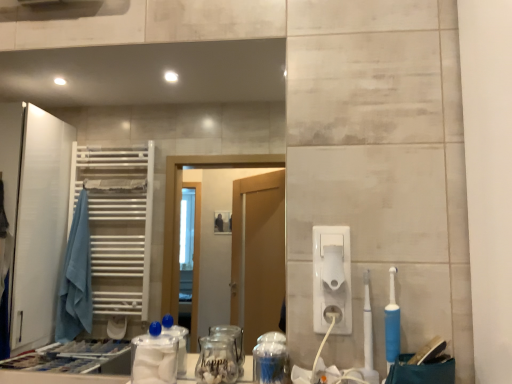
What is the approximate width of white plastic toothbrush at right, placed as the 2th toothbrush when sorted from right to left?

It is 2.90 centimeters.

Measure the distance between point (368, 293) and camera.

A distance of 35.08 inches exists between point (368, 293) and camera.

This screenshot has width=512, height=384. What do you see at coordinates (154, 357) in the screenshot?
I see `transparent plastic container at center` at bounding box center [154, 357].

The height and width of the screenshot is (384, 512). I want to click on transparent glass jar at center, the 2th glass jar when ordered from right to left, so click(x=216, y=360).

Where is `matte white mirror at upper center`? matte white mirror at upper center is located at coordinates (159, 69).

This screenshot has width=512, height=384. I want to click on transparent glass jar at center, which is the 2th glass jar in left-to-right order, so click(270, 359).

From a real-world perspective, which object stands above the other?

In real-world perspective, white plastic toothbrush at right, the first toothbrush from the left, is above.

Between white plastic toothbrush at right, placed as the 2th toothbrush when sorted from right to left, and transparent glass jar at center, the 1th glass jar viewed from the left, which one has smaller size?

With smaller size is white plastic toothbrush at right, placed as the 2th toothbrush when sorted from right to left.

Considering the sizes of objects white plastic toothbrush at right, placed as the 2th toothbrush when sorted from right to left, and transparent glass jar at center, the 2th glass jar when ordered from right to left, in the image provided, who is taller, white plastic toothbrush at right, placed as the 2th toothbrush when sorted from right to left, or transparent glass jar at center, the 2th glass jar when ordered from right to left,?

Standing taller between the two is white plastic toothbrush at right, placed as the 2th toothbrush when sorted from right to left.

What's the angular difference between white plastic toothbrush at right, placed as the 2th toothbrush when sorted from right to left, and transparent glass jar at center, the 1th glass jar viewed from the left,'s facing directions?

white plastic toothbrush at right, placed as the 2th toothbrush when sorted from right to left, and transparent glass jar at center, the 1th glass jar viewed from the left, are facing 6.18 degrees away from each other.

Is matte white mirror at upper center at the left side of white plastic toothbrush at right, placed as the 2th toothbrush when sorted from right to left?

Indeed, matte white mirror at upper center is positioned on the left side of white plastic toothbrush at right, placed as the 2th toothbrush when sorted from right to left.

Does point (62, 61) come farther from viewer compared to point (367, 307)?

Yes, point (62, 61) is farther from viewer.

Is white plastic toothbrush at right, the first toothbrush from the left, completely or partially inside matte white mirror at upper center?

No, white plastic toothbrush at right, the first toothbrush from the left, is not a part of matte white mirror at upper center.

Does matte white mirror at upper center lie behind white plastic toothbrush at right, placed as the 2th toothbrush when sorted from right to left?

Yes, matte white mirror at upper center is further from the camera.

At what (x,y) coordinates should I click in order to perform the action: click on hand dryer behind the white plastic toilet paper at center-right. Please return your answer as a coordinate pair (x, y). The width and height of the screenshot is (512, 384). Looking at the image, I should click on (332, 278).

Which point is more distant from viewer, (318, 265) or (329, 256)?

The point (318, 265) is farther from the camera.

Considering the sizes of objects white plastic hand dryer at right and white plastic toilet paper at center-right in the image provided, who is thinner, white plastic hand dryer at right or white plastic toilet paper at center-right?

white plastic hand dryer at right is thinner.

Considering the relative sizes of white plastic hand dryer at right and white plastic toilet paper at center-right in the image provided, is white plastic hand dryer at right bigger than white plastic toilet paper at center-right?

Correct, white plastic hand dryer at right is larger in size than white plastic toilet paper at center-right.

How far apart are transparent glass jar at center, the 2th glass jar when ordered from right to left, and white plastic toilet paper at center-right?

They are 10.68 inches apart.

The width and height of the screenshot is (512, 384). In the image, there is a transparent glass jar at center, the 2th glass jar when ordered from right to left. What are the coordinates of `toilet paper above it (from the image's perspective)` in the screenshot? It's located at (333, 266).

Does transparent glass jar at center, the 2th glass jar when ordered from right to left, have a greater height compared to white plastic toilet paper at center-right?

Yes, transparent glass jar at center, the 2th glass jar when ordered from right to left, is taller than white plastic toilet paper at center-right.

What's the angular difference between transparent glass jar at center, the 2th glass jar when ordered from right to left, and white plastic toilet paper at center-right's facing directions?

The facing directions of transparent glass jar at center, the 2th glass jar when ordered from right to left, and white plastic toilet paper at center-right are 4.22 degrees apart.

Which of these two, transparent glass jar at center, the 1th glass jar viewed from the left, or matte white mirror at upper center, stands taller?

matte white mirror at upper center.

Locate an element on the screen. The image size is (512, 384). mirror that appears on the left of transparent glass jar at center, the 2th glass jar when ordered from right to left is located at coordinates (159, 69).

From the image's perspective, is transparent glass jar at center, the 1th glass jar viewed from the left, under matte white mirror at upper center?

Indeed, from the image's perspective, transparent glass jar at center, the 1th glass jar viewed from the left, is shown beneath matte white mirror at upper center.

In the scene shown: From a real-world perspective, is transparent glass jar at center, the 1th glass jar viewed from the left, above or below matte white mirror at upper center?

transparent glass jar at center, the 1th glass jar viewed from the left, is below matte white mirror at upper center.

From the image's perspective, which one is positioned lower, transparent glass jar at center, which is the 2th glass jar in left-to-right order, or white plastic hand dryer at right?

transparent glass jar at center, which is the 2th glass jar in left-to-right order.

The image size is (512, 384). In order to click on glass jar that is the 1st object to the left of the white plastic hand dryer at right, starting at the anchor in this screenshot , I will do `click(270, 359)`.

Does transparent glass jar at center, which appears as the 1th glass jar when viewed from the right, have a smaller size compared to white plastic hand dryer at right?

No.

Is the surface of transparent glass jar at center, which is the 2th glass jar in left-to-right order, in direct contact with transparent glass jar at center, the 1th glass jar viewed from the left?

Yes, transparent glass jar at center, which is the 2th glass jar in left-to-right order, is next to transparent glass jar at center, the 1th glass jar viewed from the left.

Is transparent glass jar at center, which is the 2th glass jar in left-to-right order, bigger or smaller than transparent glass jar at center, the 1th glass jar viewed from the left?

transparent glass jar at center, which is the 2th glass jar in left-to-right order, is smaller than transparent glass jar at center, the 1th glass jar viewed from the left.

Is transparent glass jar at center, which appears as the 1th glass jar when viewed from the right, spatially inside transparent glass jar at center, the 2th glass jar when ordered from right to left, or outside of it?

transparent glass jar at center, which appears as the 1th glass jar when viewed from the right, is located beyond the bounds of transparent glass jar at center, the 2th glass jar when ordered from right to left.

From the image's perspective, which toothbrush is the 1st one above the transparent glass jar at center, the 2th glass jar when ordered from right to left? Please provide its 2D coordinates.

[(368, 336)]

Where is `the 1st toothbrush to the right of the matte white mirror at upper center, starting your count from the anchor`? the 1st toothbrush to the right of the matte white mirror at upper center, starting your count from the anchor is located at coordinates (368, 336).

Looking at the image, which one is located further to transparent glass jar at center, which appears as the 1th glass jar when viewed from the right, transparent glass jar at center, the 1th glass jar viewed from the left, or transparent plastic container at center?

transparent plastic container at center.

Estimate the real-world distances between objects in this image. Which object is closer to transparent glass jar at center, the 2th glass jar when ordered from right to left, white plastic hand dryer at right or blue rubber toothbrush at right, which is counted as the 2th toothbrush, starting from the left?

white plastic hand dryer at right lies closer to transparent glass jar at center, the 2th glass jar when ordered from right to left, than the other object.

Looking at the image, which one is located further to transparent glass jar at center, the 2th glass jar when ordered from right to left, white plastic toothbrush at right, the first toothbrush from the left, or matte white mirror at upper center?

matte white mirror at upper center.

From the image, which object appears to be nearer to transparent glass jar at center, which is the 2th glass jar in left-to-right order, white plastic toilet paper at center-right or white plastic hand dryer at right?

The object closer to transparent glass jar at center, which is the 2th glass jar in left-to-right order, is white plastic hand dryer at right.

From the image, which object appears to be farther from blue rubber toothbrush at right, acting as the 1th toothbrush starting from the right, white plastic toilet paper at center-right or white plastic toothbrush at right, placed as the 2th toothbrush when sorted from right to left?

white plastic toilet paper at center-right is further to blue rubber toothbrush at right, acting as the 1th toothbrush starting from the right.

Based on their spatial positions, is white plastic toothbrush at right, the first toothbrush from the left, or white plastic toilet paper at center-right closer to matte white mirror at upper center?

white plastic toilet paper at center-right is positioned closer to the anchor matte white mirror at upper center.

Consider the image. Looking at the image, which one is located closer to white plastic toilet paper at center-right, blue rubber toothbrush at right, which is counted as the 2th toothbrush, starting from the left, or transparent plastic container at center?

Among the two, blue rubber toothbrush at right, which is counted as the 2th toothbrush, starting from the left, is located nearer to white plastic toilet paper at center-right.

Considering their positions, is transparent plastic container at center positioned closer to white plastic toilet paper at center-right than white plastic toothbrush at right, placed as the 2th toothbrush when sorted from right to left?

white plastic toothbrush at right, placed as the 2th toothbrush when sorted from right to left, is closer to white plastic toilet paper at center-right.

Where is `toothbrush located between white plastic hand dryer at right and blue rubber toothbrush at right, acting as the 1th toothbrush starting from the right, in the left-right direction`? The image size is (512, 384). toothbrush located between white plastic hand dryer at right and blue rubber toothbrush at right, acting as the 1th toothbrush starting from the right, in the left-right direction is located at coordinates (368, 336).

Image resolution: width=512 pixels, height=384 pixels. Identify the location of toilet paper situated between transparent glass jar at center, the 1th glass jar viewed from the left, and white plastic hand dryer at right from left to right. (333, 266).

Where is `hand dryer situated between transparent glass jar at center, which is the 2th glass jar in left-to-right order, and white plastic toothbrush at right, placed as the 2th toothbrush when sorted from right to left, from left to right`? This screenshot has width=512, height=384. hand dryer situated between transparent glass jar at center, which is the 2th glass jar in left-to-right order, and white plastic toothbrush at right, placed as the 2th toothbrush when sorted from right to left, from left to right is located at coordinates (332, 278).

This screenshot has height=384, width=512. What are the coordinates of `toilet paper between transparent glass jar at center, the 2th glass jar when ordered from right to left, and white plastic toothbrush at right, the first toothbrush from the left, from left to right` in the screenshot? It's located at (333, 266).